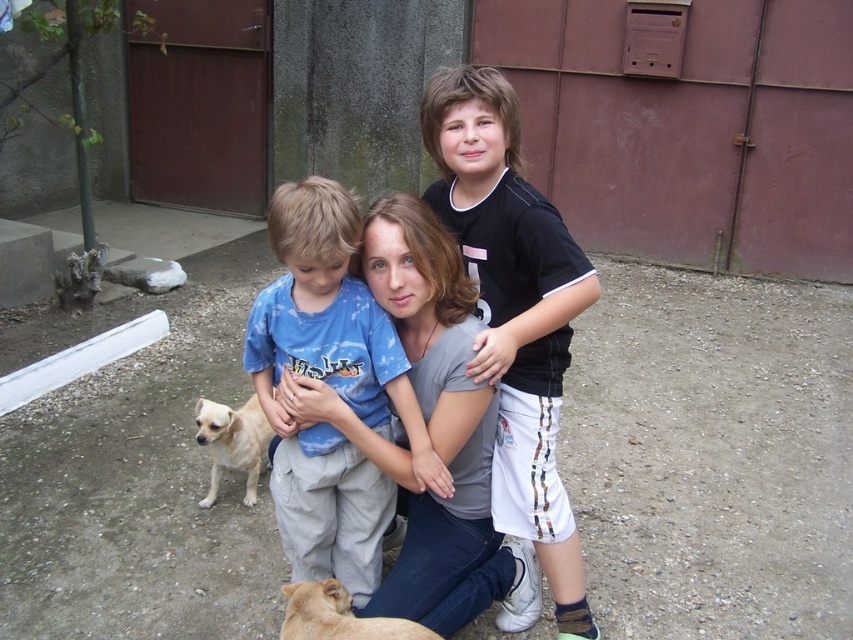
You are a delivery person trying to place a package in the mailbox on the wall. You see two light brown furs in the scene. How far apart are the light brown fur at lower center and the light brown fur at lower left?

The light brown fur at lower center and the light brown fur at lower left are 3.39 feet apart.